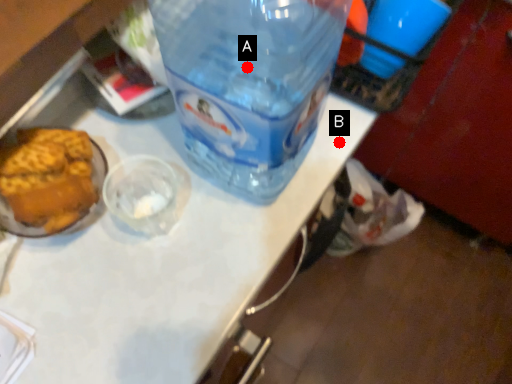
Question: Two points are circled on the image, labeled by A and B beside each circle. Which of the following is the closest to the observer?

Choices:
 (A) A is closer
 (B) B is closer

Answer: (A)